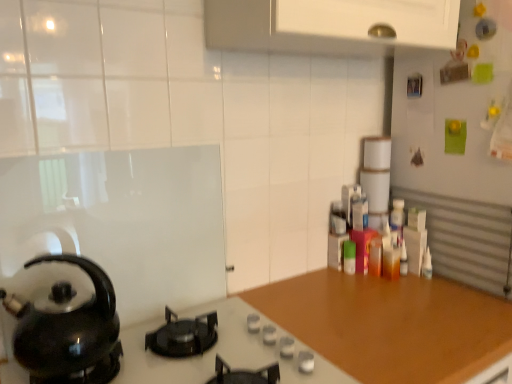
Question: Visually, is wooden at center positioned to the left or to the right of black matte gas stove at center?

Choices:
 (A) left
 (B) right

Answer: (B)

Question: Is wooden at center wider or thinner than black matte gas stove at center?

Choices:
 (A) wide
 (B) thin

Answer: (A)

Question: Estimate the real-world distances between objects in this image. Which object is farther from the wooden at center?

Choices:
 (A) black glossy kettle at left
 (B) black matte gas stove at center

Answer: (A)

Question: Which object is the closest to the black matte gas stove at center?

Choices:
 (A) wooden at center
 (B) black glossy kettle at left

Answer: (A)